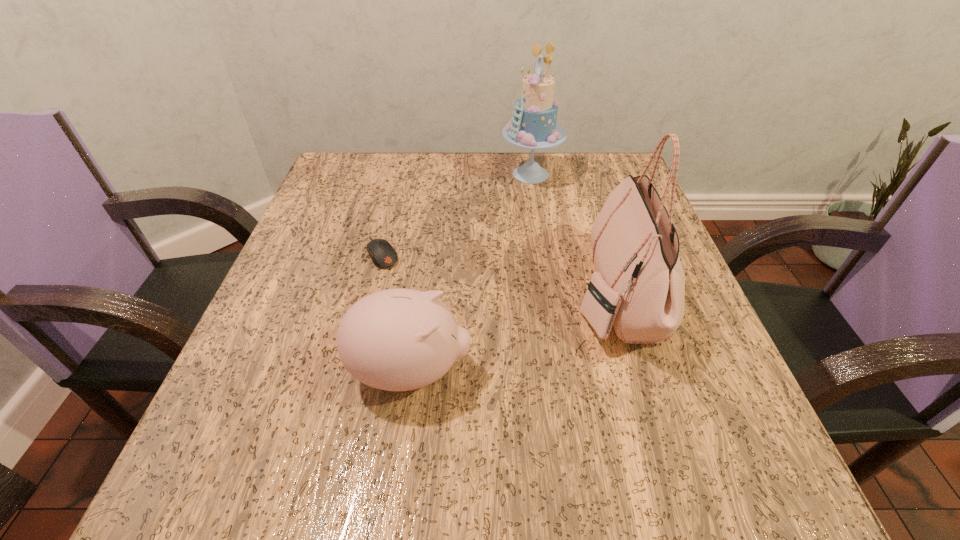
I want to click on blank space at the far right corner, so click(583, 168).

The image size is (960, 540). I want to click on vacant area at the near right corner of the desktop, so pos(676,454).

The height and width of the screenshot is (540, 960). In order to click on vacant region between the handbag and the computer mouse in this screenshot , I will do `click(499, 273)`.

The image size is (960, 540). Identify the location of vacant space that's between the second shortest object and the cake. (470, 273).

You are a GUI agent. You are given a task and a screenshot of the screen. Output one action in this format:
    pyautogui.click(x=<x>, y=<y>)
    Task: Click on the free space between the handbag and the cake
    Image resolution: width=960 pixels, height=540 pixels.
    Given the screenshot: What is the action you would take?
    pyautogui.click(x=573, y=234)

Locate an element on the screen. The image size is (960, 540). vacant space in between the handbag and the third tallest object is located at coordinates (513, 333).

Find the location of a particular element. Image resolution: width=960 pixels, height=540 pixels. vacant space that is in between the cake and the shortest object is located at coordinates (457, 213).

Where is `free space that is in between the farthest object and the handbag`? This screenshot has width=960, height=540. free space that is in between the farthest object and the handbag is located at coordinates (573, 234).

Locate an element on the screen. The height and width of the screenshot is (540, 960). unoccupied position between the second shortest object and the cake is located at coordinates (470, 273).

Where is `vacant point located between the farthest object and the piggy bank`? vacant point located between the farthest object and the piggy bank is located at coordinates (470, 273).